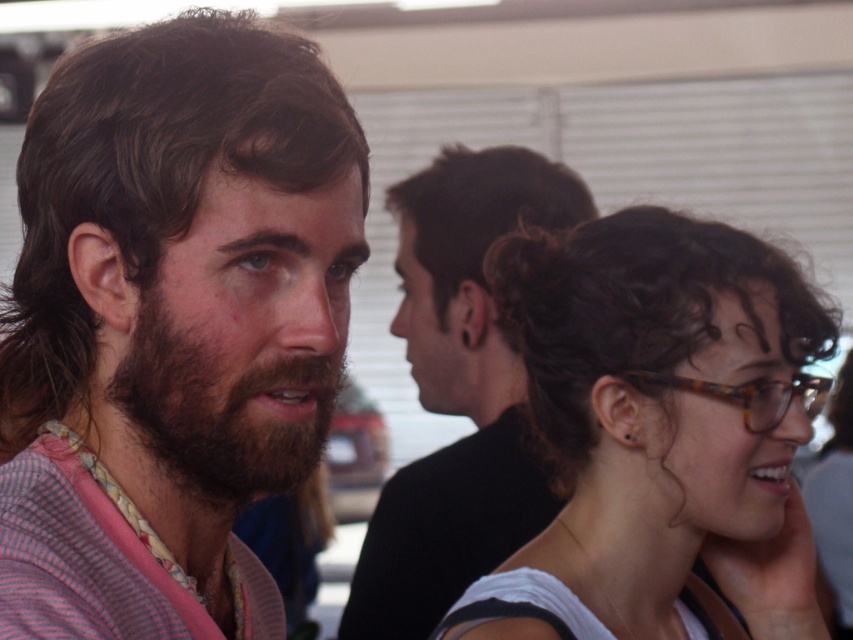
Question: Does brownwoollybeard at left have a lesser width compared to dark brown curly hair at center?

Choices:
 (A) yes
 (B) no

Answer: (A)

Question: Estimate the real-world distances between objects in this image. Which object is closer to the dark brown hair at center?

Choices:
 (A) brown hair at center
 (B) striped fabric shirt at left

Answer: (A)

Question: Among these objects, which one is farthest from the camera?

Choices:
 (A) striped fabric shirt at left
 (B) dark brown hair at center
 (C) brown hair at center
 (D) dark brown curly hair at center

Answer: (D)

Question: Which of the following is the farthest from the observer?

Choices:
 (A) dark brown hair at center
 (B) brownwoollybeard at left
 (C) tortoiseshell glasses at center

Answer: (A)

Question: Can you confirm if brown hair at center is positioned above dark brown hair at center?

Choices:
 (A) no
 (B) yes

Answer: (A)

Question: In this image, where is brownwoollybeard at left located relative to dark brown curly hair at center?

Choices:
 (A) left
 (B) right

Answer: (A)